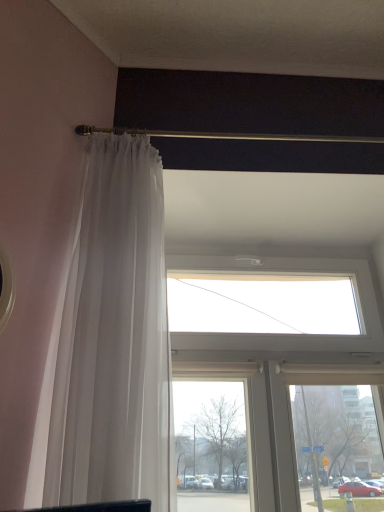
Question: From the image's perspective, is gold metallic rod at upper center above or below transparent glass window at upper center?

Choices:
 (A) above
 (B) below

Answer: (A)

Question: Is gold metallic rod at upper center spatially inside transparent glass window at upper center, or outside of it?

Choices:
 (A) inside
 (B) outside

Answer: (B)

Question: Estimate the real-world distances between objects in this image. Which object is farther from the transparent glass window at upper center?

Choices:
 (A) sheer white curtain at left
 (B) gold metallic rod at upper center

Answer: (B)

Question: Which is nearer to the sheer white curtain at left?

Choices:
 (A) transparent glass window at upper center
 (B) gold metallic rod at upper center

Answer: (B)